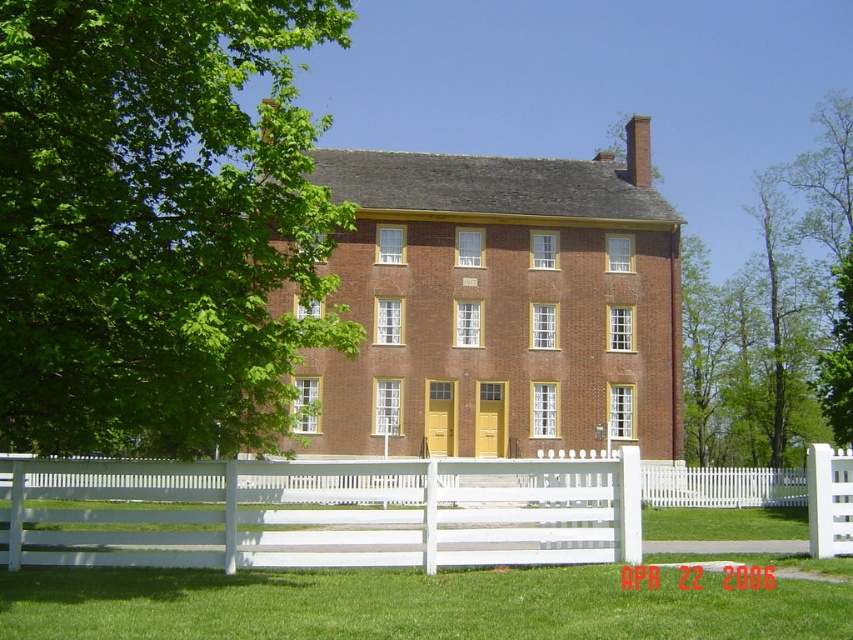
Is point (1, 145) behind point (425, 531)?

No, (1, 145) is in front of (425, 531).

Does green leafy tree at left have a smaller size compared to white wooden fence at lower center?

No, green leafy tree at left is not smaller than white wooden fence at lower center.

Where is `green leafy tree at left`? The width and height of the screenshot is (853, 640). green leafy tree at left is located at coordinates (157, 221).